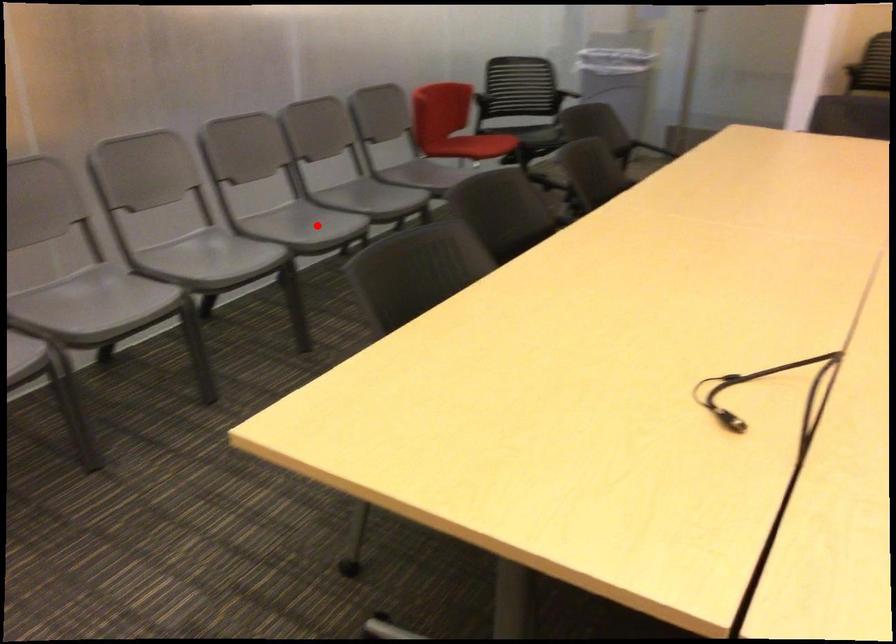
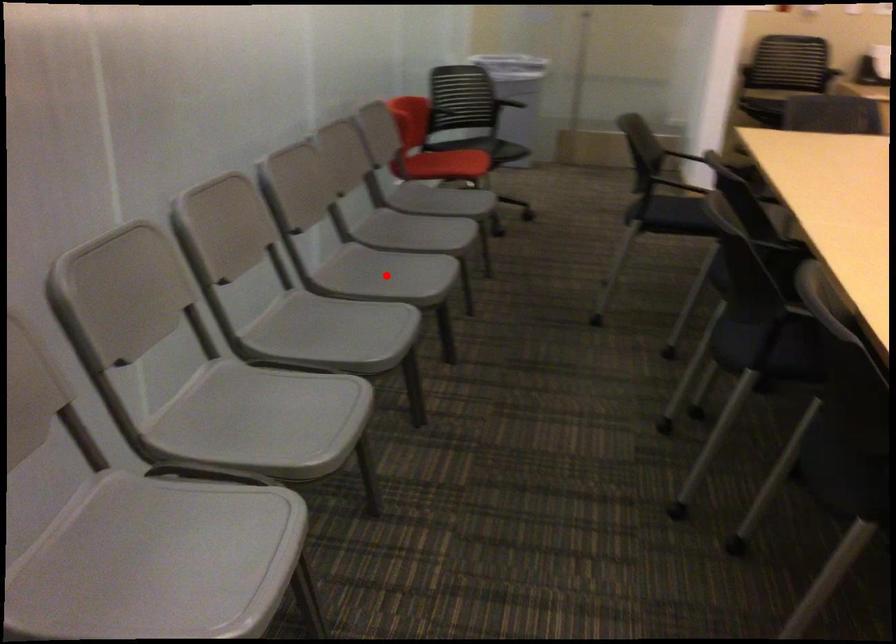
I am providing you with two images of the same scene from different viewpoints. A red point is marked on the first image and another point is marked on the second image. Is the red point in image1 aligned with the point shown in image2?

Yes